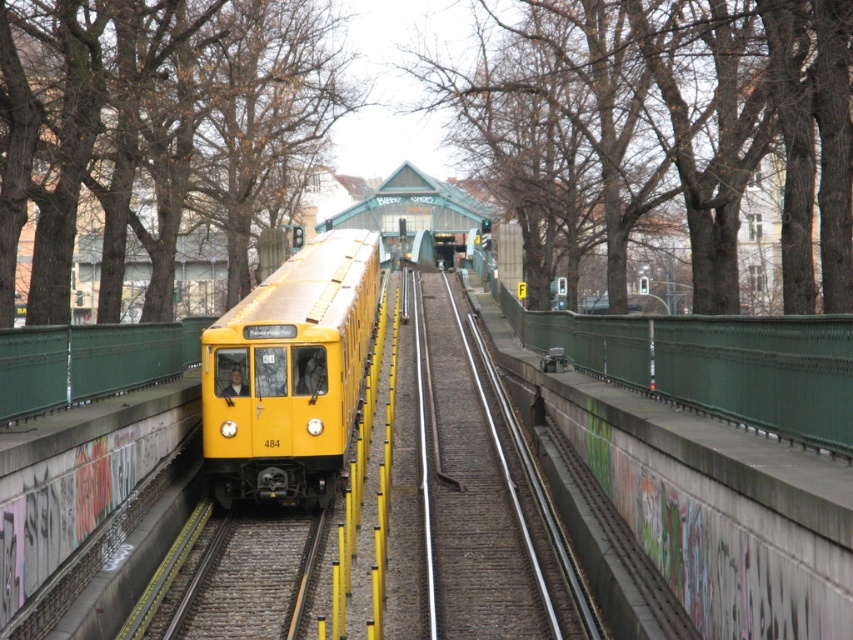
Question: Can you confirm if bare branches at upper center is smaller than brown leafless tree at left?

Choices:
 (A) no
 (B) yes

Answer: (A)

Question: Is brown leafless tree at left wider than yellow matte train at center?

Choices:
 (A) no
 (B) yes

Answer: (B)

Question: Can you confirm if brown leafless tree at left is positioned below yellow matte train at center?

Choices:
 (A) yes
 (B) no

Answer: (B)

Question: Which object appears closest to the camera in this image?

Choices:
 (A) bare branches at upper center
 (B) yellow matte train at center
 (C) brown leafless tree at left

Answer: (A)

Question: Based on their relative distances, which object is farther from the bare branches at upper center?

Choices:
 (A) yellow matte train at center
 (B) brown leafless tree at left

Answer: (B)

Question: Which object appears closest to the camera in this image?

Choices:
 (A) yellow matte train at center
 (B) brown leafless tree at left

Answer: (B)